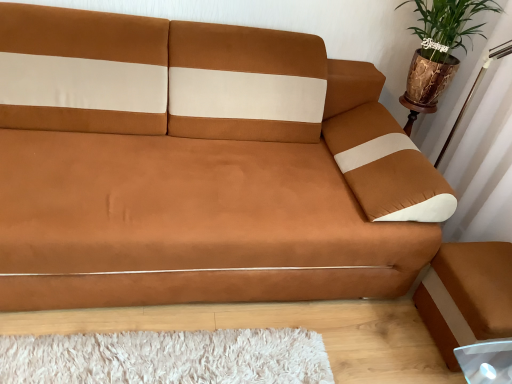
This screenshot has height=384, width=512. Identify the location of green leafy plant in brown pot at upper right. [439, 47].

At what (x,y) coordinates should I click in order to perform the action: click on suede brown couch at center. Please return your answer as a coordinate pair (x, y). This screenshot has height=384, width=512. Looking at the image, I should click on (199, 177).

Is green leafy plant in brown pot at upper right next to suede brown couch at center and touching it?

No, green leafy plant in brown pot at upper right is not touching suede brown couch at center.

Considering the sizes of objects green leafy plant in brown pot at upper right and suede brown couch at center in the image provided, who is thinner, green leafy plant in brown pot at upper right or suede brown couch at center?

green leafy plant in brown pot at upper right.

Is green leafy plant in brown pot at upper right completely or partially outside of suede brown couch at center?

green leafy plant in brown pot at upper right lies outside suede brown couch at center's area.

Which is more to the right, green leafy plant in brown pot at upper right or suede brown couch at center?

Positioned to the right is green leafy plant in brown pot at upper right.

From a real-world perspective, is green leafy plant in brown pot at upper right below brown leather footrest at lower right?

No, from a real-world perspective, green leafy plant in brown pot at upper right is not below brown leather footrest at lower right.

Is green leafy plant in brown pot at upper right far away from brown leather footrest at lower right?

No, there isn't a large distance between green leafy plant in brown pot at upper right and brown leather footrest at lower right.

Between green leafy plant in brown pot at upper right and brown leather footrest at lower right, which one has smaller size?

With smaller size is brown leather footrest at lower right.

From the image's perspective, which object appears higher, brown leather footrest at lower right or suede brown couch at center?

suede brown couch at center, from the image's perspective.

From a real-world perspective, is brown leather footrest at lower right positioned above or below suede brown couch at center?

brown leather footrest at lower right is below suede brown couch at center.

From the picture: Which object is positioned more to the left, brown leather footrest at lower right or green leafy plant in brown pot at upper right?

Positioned to the left is green leafy plant in brown pot at upper right.

Is brown leather footrest at lower right positioned before green leafy plant in brown pot at upper right?

Yes, brown leather footrest at lower right is closer to the camera.

Considering the sizes of objects brown leather footrest at lower right and green leafy plant in brown pot at upper right in the image provided, who is taller, brown leather footrest at lower right or green leafy plant in brown pot at upper right?

With more height is green leafy plant in brown pot at upper right.

Does brown leather footrest at lower right turn towards green leafy plant in brown pot at upper right?

No.

I want to click on the footrest that appears below the suede brown couch at center (from a real-world perspective), so click(467, 295).

Considering the relative sizes of suede brown couch at center and brown leather footrest at lower right in the image provided, is suede brown couch at center bigger than brown leather footrest at lower right?

Yes.

Based on the photo, how distant is suede brown couch at center from brown leather footrest at lower right?

suede brown couch at center is 25.19 inches from brown leather footrest at lower right.

From the image's perspective, which is above, suede brown couch at center or green leafy plant in brown pot at upper right?

From the image's view, green leafy plant in brown pot at upper right is above.

Can you tell me how much suede brown couch at center and green leafy plant in brown pot at upper right differ in facing direction?

suede brown couch at center and green leafy plant in brown pot at upper right are facing 1.44 degrees away from each other.

Between suede brown couch at center and green leafy plant in brown pot at upper right, which one is positioned in front?

suede brown couch at center.

Between suede brown couch at center and green leafy plant in brown pot at upper right, which one appears on the left side from the viewer's perspective?

From the viewer's perspective, suede brown couch at center appears more on the left side.

This screenshot has width=512, height=384. I want to click on studio couch located below the green leafy plant in brown pot at upper right (from the image's perspective), so click(x=199, y=177).

Where is `footrest in front of the green leafy plant in brown pot at upper right`? footrest in front of the green leafy plant in brown pot at upper right is located at coordinates (467, 295).

Which object lies nearer to the anchor point brown leather footrest at lower right, suede brown couch at center or green leafy plant in brown pot at upper right?

suede brown couch at center lies closer to brown leather footrest at lower right than the other object.

Considering their positions, is brown leather footrest at lower right positioned further to green leafy plant in brown pot at upper right than suede brown couch at center?

Among the two, brown leather footrest at lower right is located further to green leafy plant in brown pot at upper right.

Estimate the real-world distances between objects in this image. Which object is further from suede brown couch at center, brown leather footrest at lower right or green leafy plant in brown pot at upper right?

green leafy plant in brown pot at upper right is further to suede brown couch at center.

Estimate the real-world distances between objects in this image. Which object is closer to green leafy plant in brown pot at upper right, suede brown couch at center or brown leather footrest at lower right?

suede brown couch at center.

Based on their spatial positions, is green leafy plant in brown pot at upper right or suede brown couch at center closer to brown leather footrest at lower right?

suede brown couch at center.

Based on their spatial positions, is green leafy plant in brown pot at upper right or brown leather footrest at lower right further from suede brown couch at center?

The object further to suede brown couch at center is green leafy plant in brown pot at upper right.

Find the location of `houseplant between suede brown couch at center and brown leather footrest at lower right from left to right`. houseplant between suede brown couch at center and brown leather footrest at lower right from left to right is located at coordinates (439, 47).